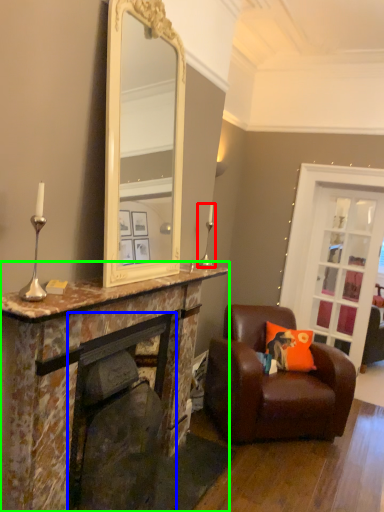
Question: Based on their relative distances, which object is nearer to candle holder (highlighted by a red box)? Choose from fireplace (highlighted by a blue box) and cabinetry (highlighted by a green box).

Choices:
 (A) fireplace
 (B) cabinetry

Answer: (B)